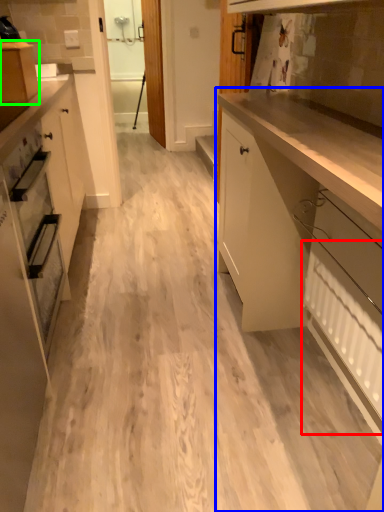
Question: Which object is positioned closest to radiator (highlighted by a red box)? Select from cabinetry (highlighted by a blue box) and cabinetry (highlighted by a green box).

Choices:
 (A) cabinetry
 (B) cabinetry

Answer: (A)